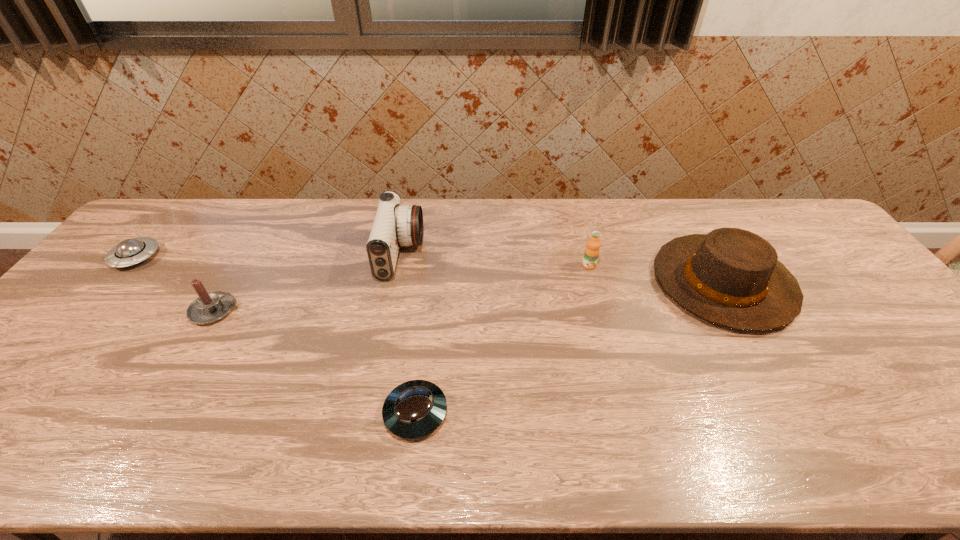
Locate an element on the screen. The width and height of the screenshot is (960, 540). vacant space at the left edge is located at coordinates (110, 267).

This screenshot has height=540, width=960. I want to click on free space at the right edge of the desktop, so click(820, 290).

In the image, there is a desktop. At what (x,y) coordinates should I click in order to perform the action: click on vacant space at the far left corner. Please return your answer as a coordinate pair (x, y). Looking at the image, I should click on (181, 221).

I want to click on blank region between the shorter saucer and the orange juice, so click(502, 339).

Locate an element on the screen. This screenshot has height=540, width=960. free space between the orange juice and the nearest object is located at coordinates (502, 339).

Identify the location of free space between the rightmost object and the camcorder. (562, 269).

Identify the location of free space between the leftmost object and the rightmost object. (429, 270).

Image resolution: width=960 pixels, height=540 pixels. In order to click on vacant space in between the leftmost object and the rightmost object in this screenshot , I will do [x=429, y=270].

What are the coordinates of `free area in between the camcorder and the rightmost object` in the screenshot? It's located at (562, 269).

Find the location of a particular element. This screenshot has height=540, width=960. free spot between the cowboy hat and the nearest object is located at coordinates (569, 348).